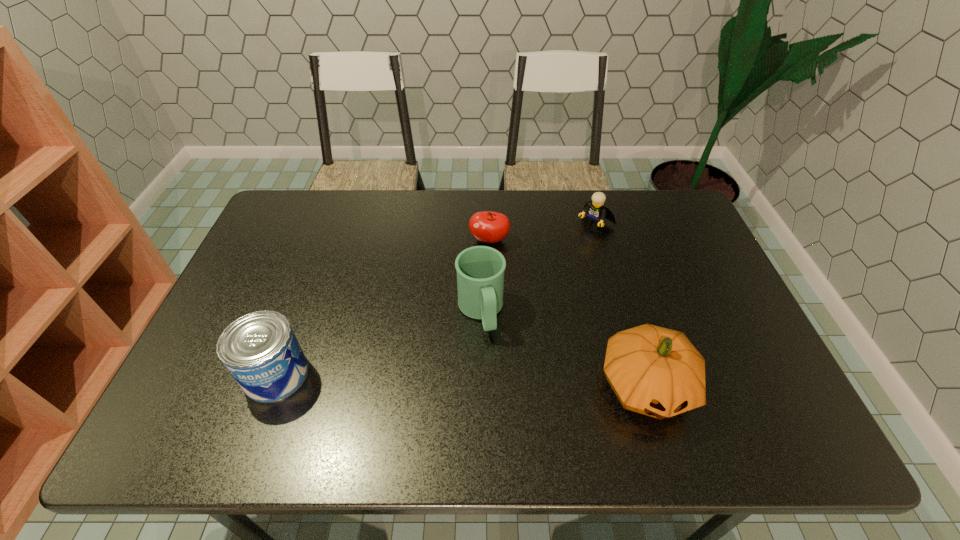
Find the location of a particular element. blank region between the apple and the Lego is located at coordinates (542, 232).

The width and height of the screenshot is (960, 540). Find the location of `free space between the gourd and the mug`. free space between the gourd and the mug is located at coordinates (564, 349).

You are a GUI agent. You are given a task and a screenshot of the screen. Output one action in this format:
    pyautogui.click(x=<x>, y=<y>)
    Task: Click on the object identified as the fourth closest to the apple
    
    Given the screenshot: What is the action you would take?
    pyautogui.click(x=260, y=350)

Select which object is the third closest to the leftmost object. Please provide its 2D coordinates. Your answer should be formatted as a tuple, i.e. [(x, y)], where the tuple contains the x and y coordinates of a point satisfying the conditions above.

[(655, 371)]

Where is `free location that satisfies the following two spatial constraints: 1. on the back side of the mug; 2. on the left side of the Lego`? free location that satisfies the following two spatial constraints: 1. on the back side of the mug; 2. on the left side of the Lego is located at coordinates (480, 223).

I want to click on free space that satisfies the following two spatial constraints: 1. on the back side of the Lego; 2. on the right side of the apple, so click(x=489, y=223).